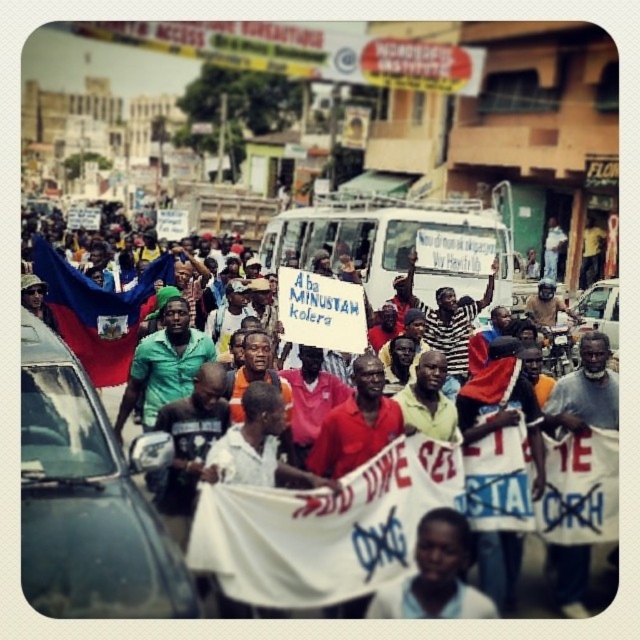
Question: Does metallic silver car at left have a larger size compared to light skin tone shirt at center?

Choices:
 (A) no
 (B) yes

Answer: (B)

Question: Which point appears closest to the camera in this image?

Choices:
 (A) (422, 538)
 (B) (616, 342)
 (C) (148, 464)

Answer: (A)

Question: Does blue fabric flag at left have a lesser width compared to light skin tone shirt at center?

Choices:
 (A) yes
 (B) no

Answer: (B)

Question: Is light skin tone shirt at center smaller than metallic silver car at right?

Choices:
 (A) yes
 (B) no

Answer: (A)

Question: Which point is closer to the camera?

Choices:
 (A) metallic silver car at right
 (B) light skin tone shirt at center
 (C) white cotton shirt at center
 (D) metallic silver car at left

Answer: (D)

Question: Which point is farther to the camera?

Choices:
 (A) blue fabric flag at left
 (B) metallic silver car at left

Answer: (A)